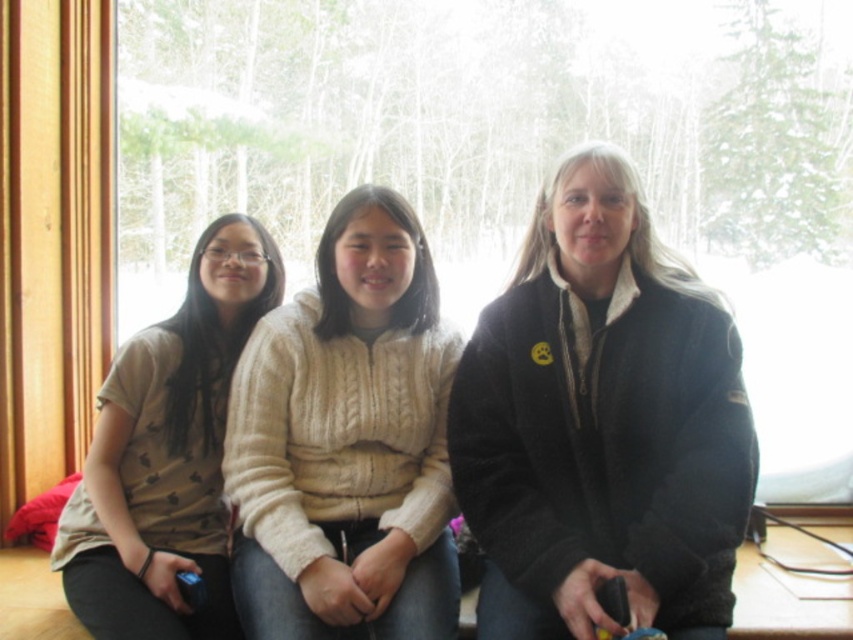
Question: Does transparent glass window at center appear on the right side of creamy knit sweater at center?

Choices:
 (A) yes
 (B) no

Answer: (A)

Question: Which point is closer to the camera?

Choices:
 (A) black fuzzy jacket at center
 (B) matte beige sweater at left

Answer: (A)

Question: Can you confirm if black fuzzy jacket at center is positioned to the left of matte beige sweater at left?

Choices:
 (A) yes
 (B) no

Answer: (B)

Question: Is black fuzzy jacket at center positioned before creamy knit sweater at center?

Choices:
 (A) yes
 (B) no

Answer: (B)

Question: Which point appears closest to the camera in this image?

Choices:
 (A) pos(155,502)
 (B) pos(656,26)
 (C) pos(634,426)

Answer: (C)

Question: Which point is farther to the camera?

Choices:
 (A) black fuzzy jacket at center
 (B) matte beige sweater at left
 (C) transparent glass window at center

Answer: (C)